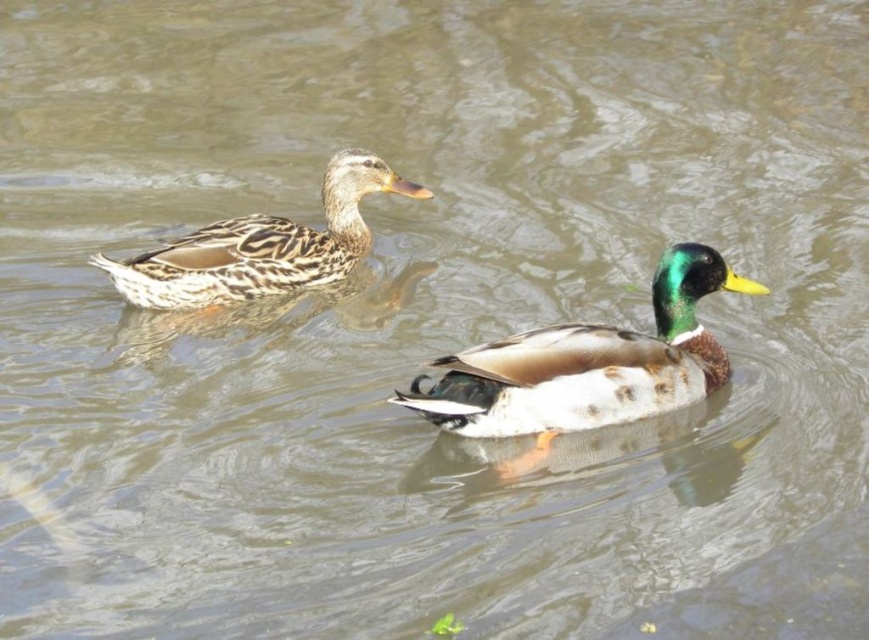
From the picture: You are standing on the edge of the water and see the green glossy duck at center. If you want to throw a small pebble to land exactly where the duck is currently located, what are the coordinates you should aim for?

The coordinates to aim for are 0.573 in the x direction and 0.677 in the y direction, as the green glossy duck at center is located at point (587, 369).

You are a birdwatcher observing the two ducks in the scene. Which duck, the green glossy duck at center or the speckled feathered duck at left, is taller?

The green glossy duck at center is taller than the speckled feathered duck at left according to the description.

You are a birdwatcher observing two ducks in the water. You see the green glossy duck at center and the speckled feathered duck at left. Which duck is located to the right of the other?

The green glossy duck at center is positioned on the right side of the speckled feathered duck at left.